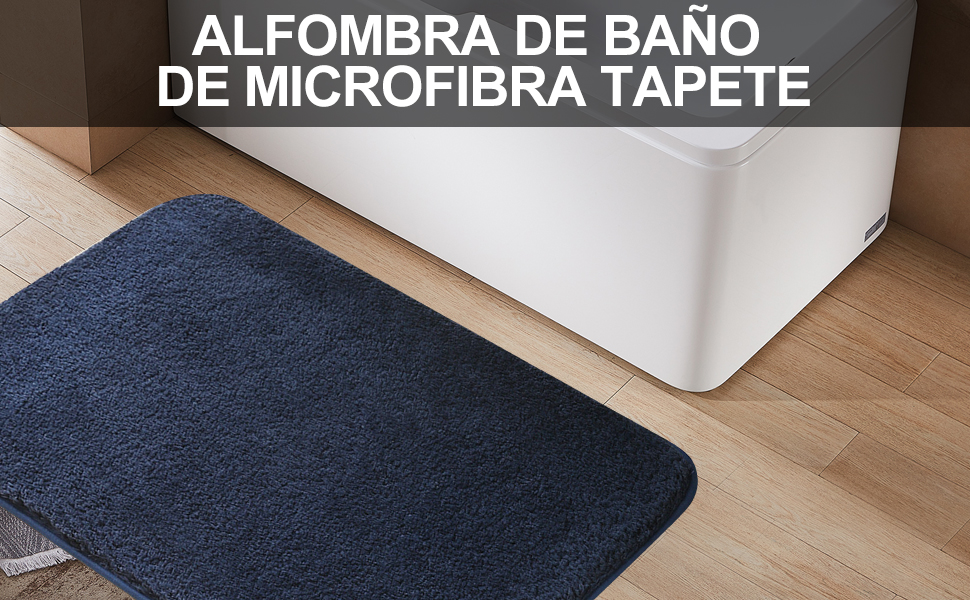
You are a GUI agent. You are given a task and a screenshot of the screen. Output one action in this format:
    pyautogui.click(x=<x>, y=<y>)
    Task: Click on the wooden floor
    The image size is (970, 600).
    Given the screenshot: What is the action you would take?
    pyautogui.click(x=824, y=504)